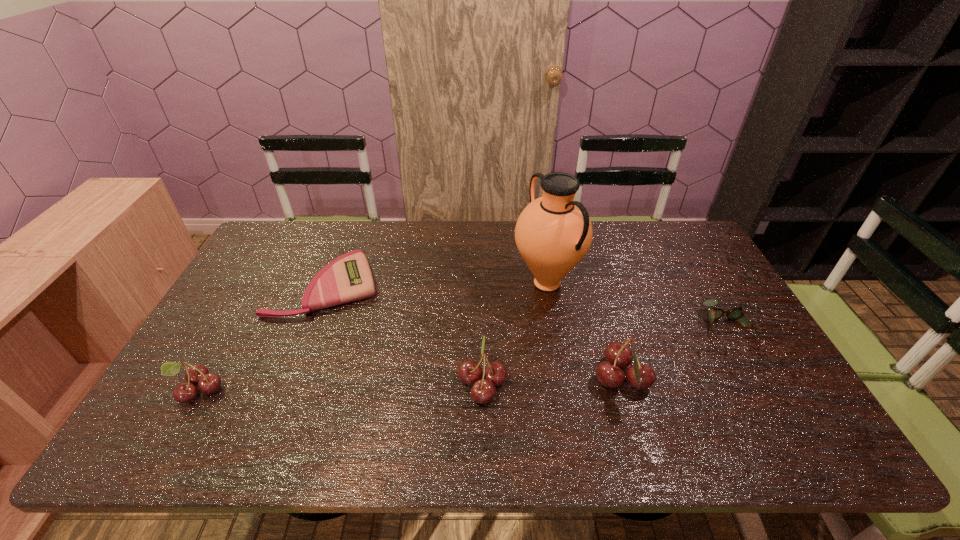
Where is `spot to insert another cherry for uniform distribution`? spot to insert another cherry for uniform distribution is located at coordinates (341, 386).